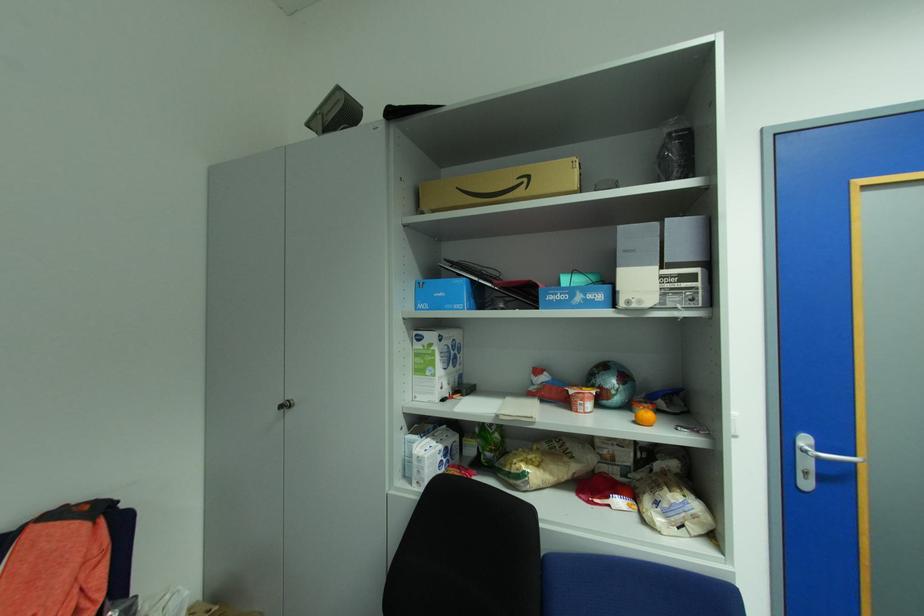
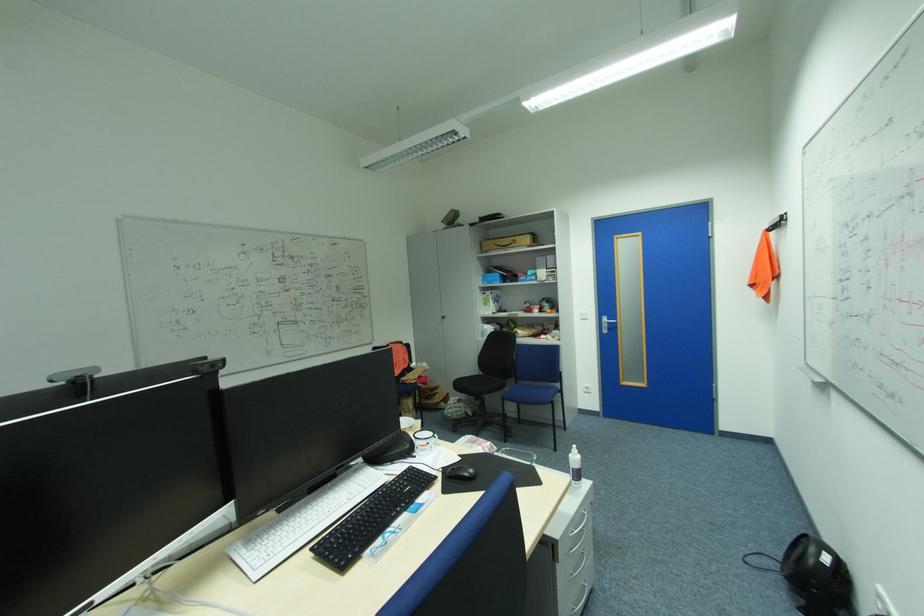
Question: The images are taken continuously from a first-person perspective. In which direction are you moving?

Choices:
 (A) Left
 (B) Right
 (C) Forward
 (D) Backward

Answer: (D)